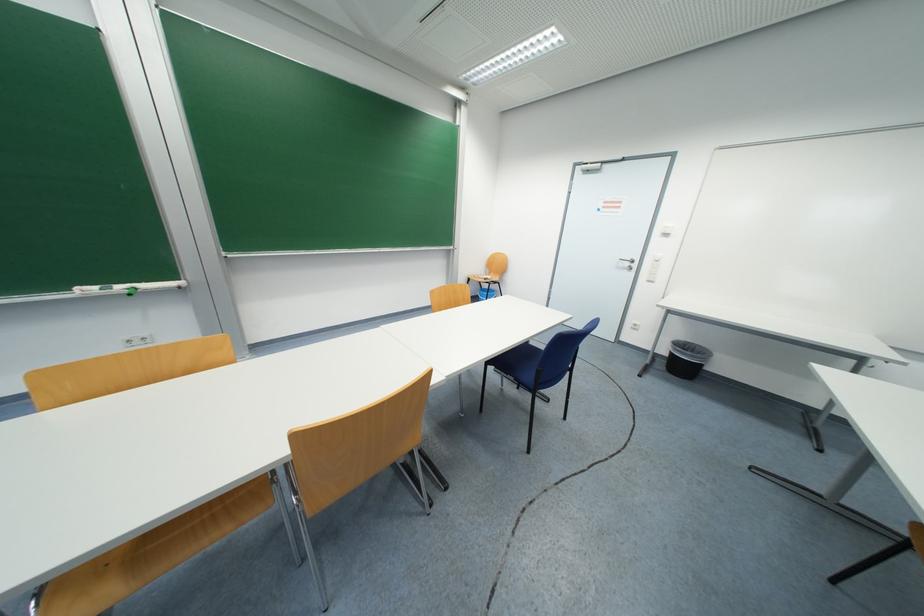
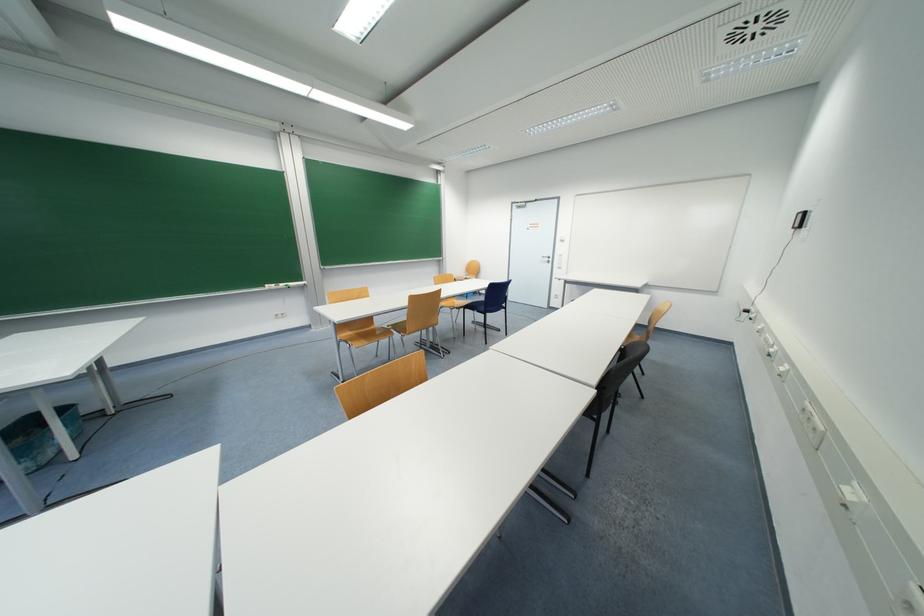
Where in the second image is the point corresponding to pixel 126 289 from the first image?

(286, 286)